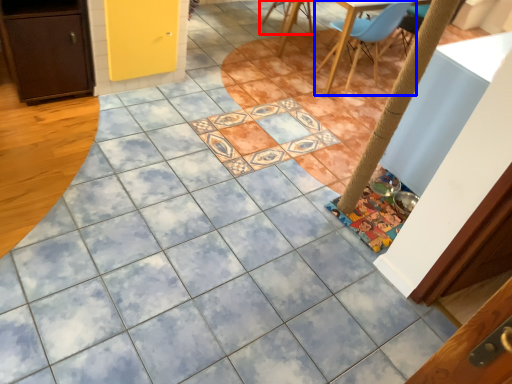
Question: Which point is closer to the camera, chair (highlighted by a red box) or chair (highlighted by a blue box)?

Choices:
 (A) chair
 (B) chair

Answer: (B)